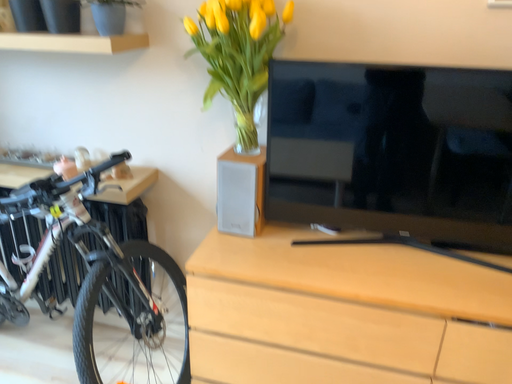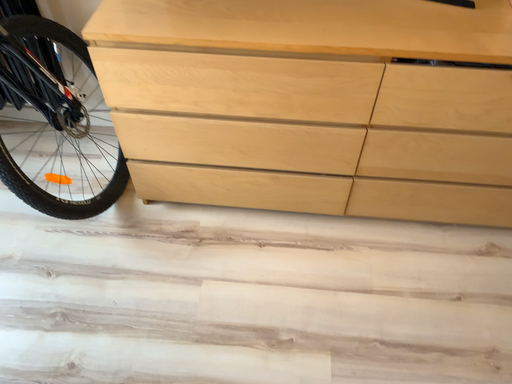
Question: How did the camera likely rotate when shooting the video?

Choices:
 (A) rotated downward
 (B) rotated upward

Answer: (A)